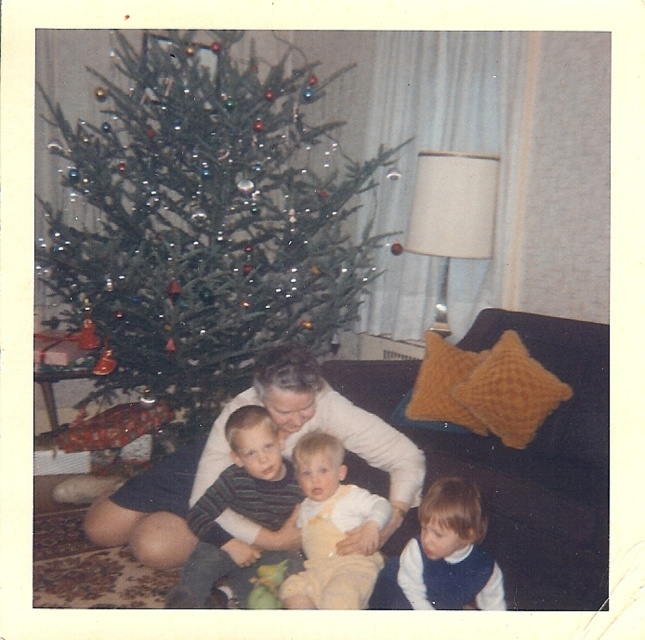
You are organizing a holiday gift wrapping station and need to decide which item to place on top of the other to save space. Given the items are the striped cotton shirt at center and the yellow cotton onesie at center, which one should you place underneath to ensure the stack doesn t collapse?

The striped cotton shirt at center has a greater height compared to the yellow cotton onesie at center. To prevent the stack from collapsing, place the taller striped cotton shirt at center underneath the shorter yellow cotton onesie at center.